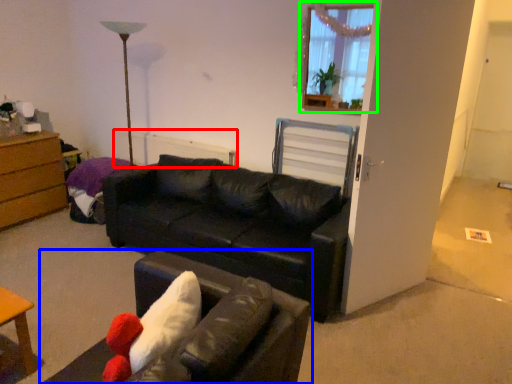
Question: Which object is the farthest from radiator (highlighted by a red box)? Choose among these: studio couch (highlighted by a blue box) or window (highlighted by a green box).

Choices:
 (A) studio couch
 (B) window

Answer: (A)